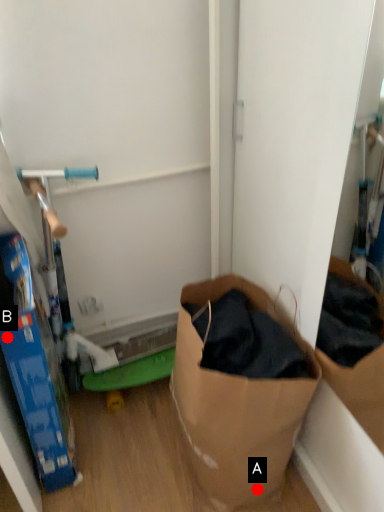
Question: Two points are circled on the image, labeled by A and B beside each circle. Which of the following is the closest to the observer?

Choices:
 (A) A is closer
 (B) B is closer

Answer: (B)